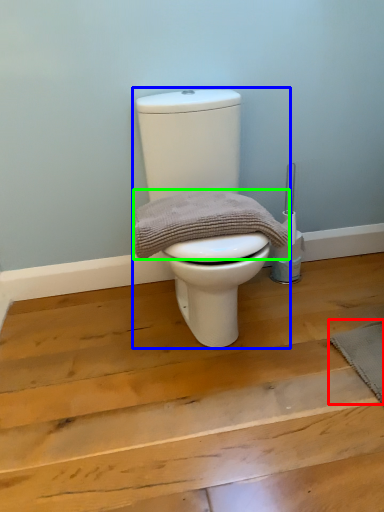
Question: Considering the real-world distances, which object is closest to doormat (highlighted by a red box)? toilet (highlighted by a blue box) or material (highlighted by a green box).

Choices:
 (A) toilet
 (B) material

Answer: (B)